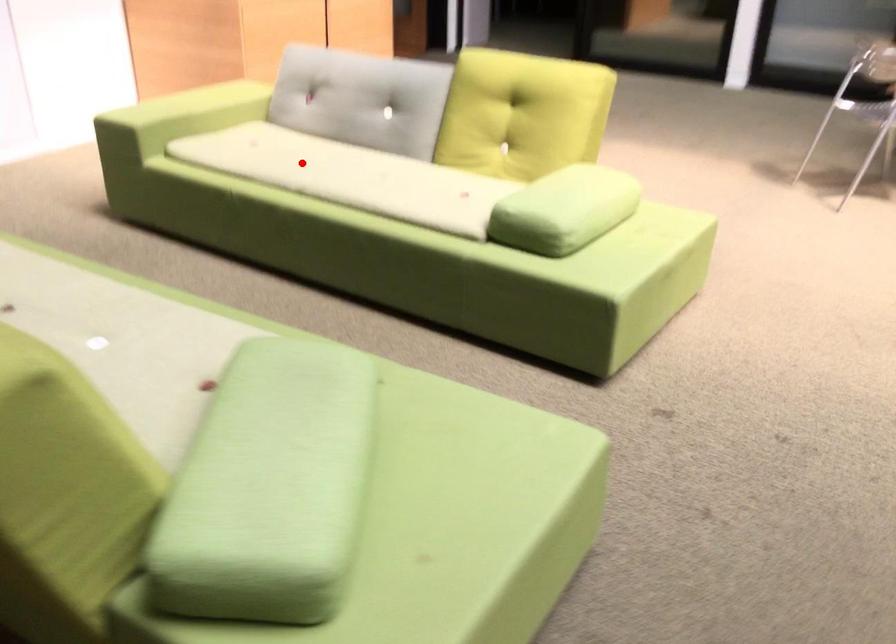
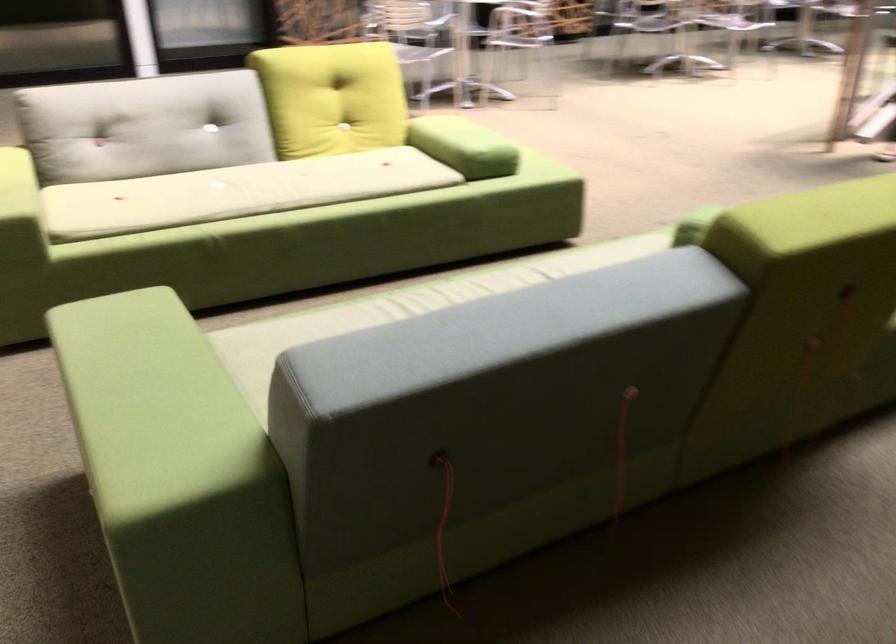
Where in the second image is the point corresponding to the highlighted location from the first image?

(236, 192)